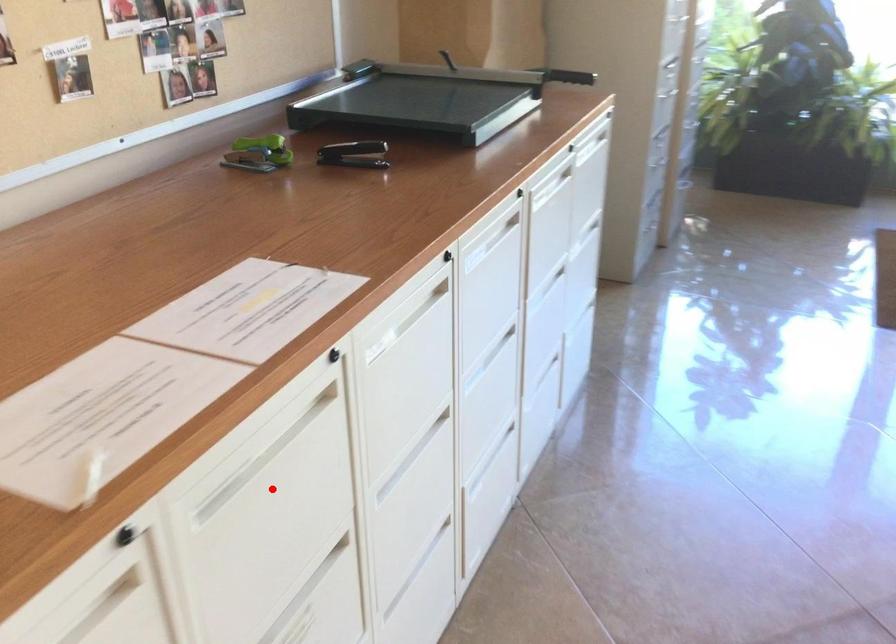
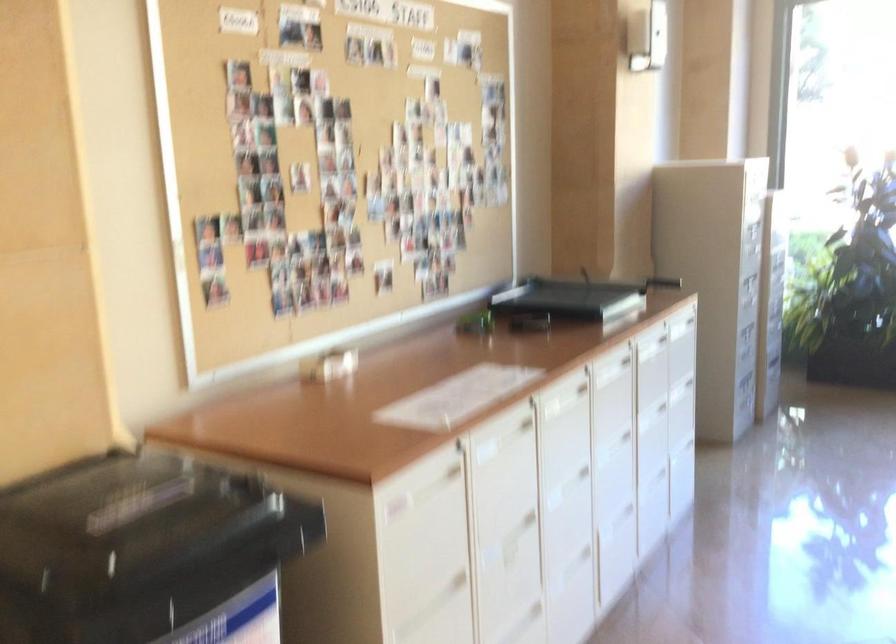
Where in the second image is the point corresponding to the highlighted location from the first image?

(503, 465)